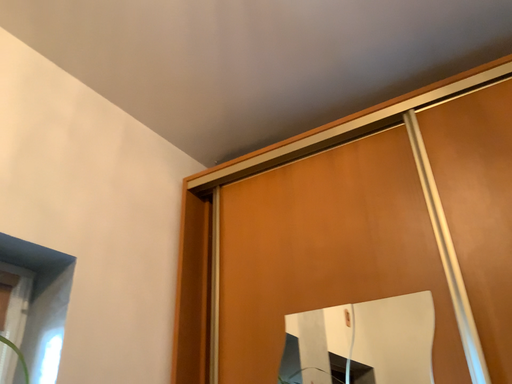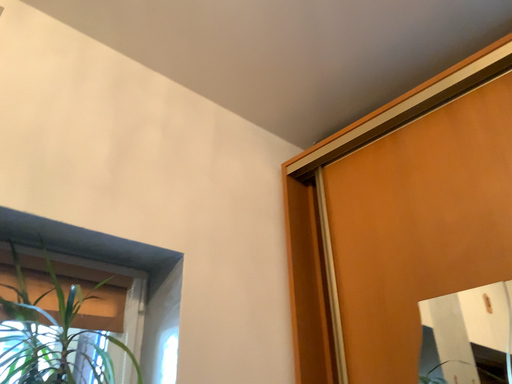
Question: How did the camera likely rotate when shooting the video?

Choices:
 (A) rotated right
 (B) rotated left

Answer: (B)